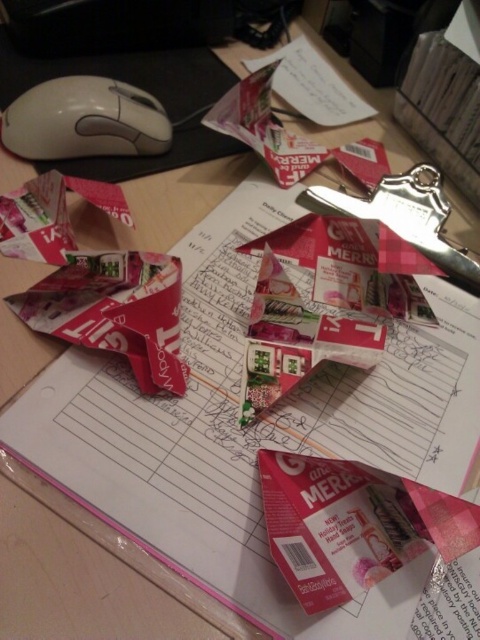
Which is above, matte gray mouse at upper left or white paper at upper center?

white paper at upper center is above.

Does point (12, 122) come behind point (327, 64)?

No, it is in front of (327, 64).

Where is `matte gray mouse at upper left`? This screenshot has width=480, height=640. matte gray mouse at upper left is located at coordinates (84, 120).

Is matte gray mouse at upper left wider than metallic silver scissors at center-right?

In fact, matte gray mouse at upper left might be narrower than metallic silver scissors at center-right.

Does matte gray mouse at upper left have a lesser width compared to metallic silver scissors at center-right?

Yes.

Does point (134, 148) come in front of point (428, 244)?

No, it is not.

In order to click on matte gray mouse at upper left in this screenshot , I will do `click(84, 120)`.

Does metallic silver scissors at center-right have a greater height compared to white paper at upper center?

No.

Which is more to the right, metallic silver scissors at center-right or white paper at upper center?

metallic silver scissors at center-right

Locate an element on the screen. This screenshot has width=480, height=640. metallic silver scissors at center-right is located at coordinates (408, 216).

Identify the location of metallic silver scissors at center-right. This screenshot has width=480, height=640. (408, 216).